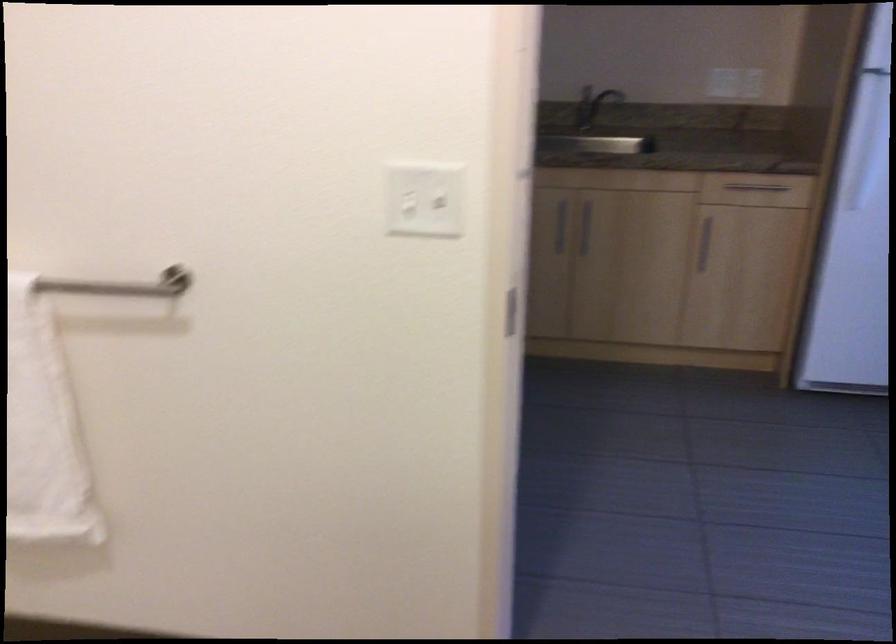
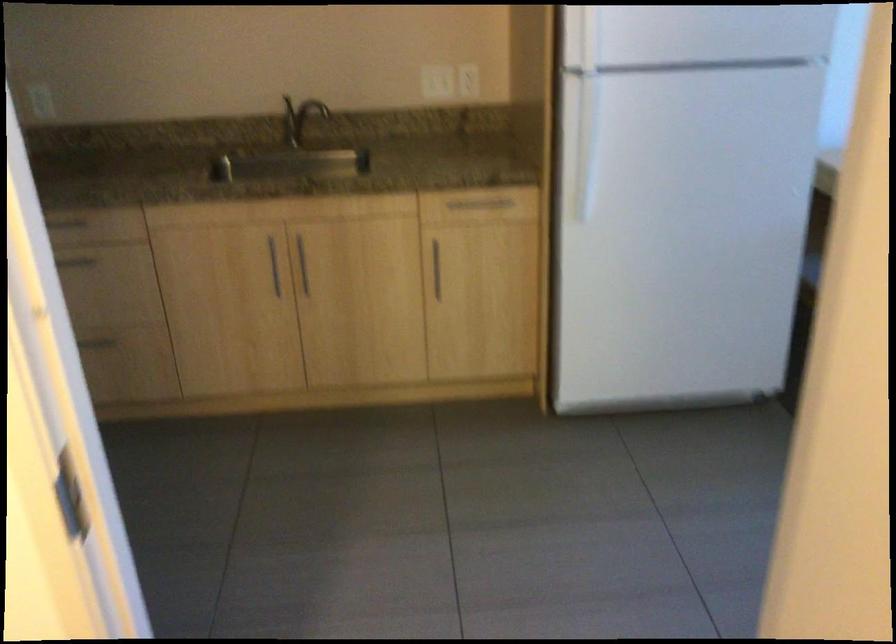
In the second image, find the point that corresponds to point (704, 75) in the first image.

(433, 80)